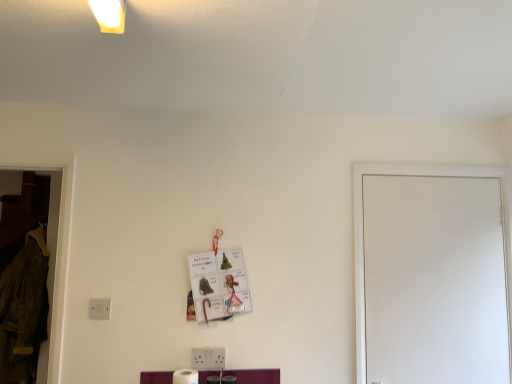
Question: In terms of width, does white matte toilet paper at lower center look wider or thinner when compared to velvet brown coat at left?

Choices:
 (A) wide
 (B) thin

Answer: (B)

Question: From the image's perspective, relative to velvet brown coat at left, is white matte toilet paper at lower center above or below?

Choices:
 (A) below
 (B) above

Answer: (A)

Question: Which object is positioned closest to the white matte toilet paper at lower center?

Choices:
 (A) velvet brown coat at left
 (B) white plastic electric outlet at lower left
 (C) white matte door at right

Answer: (B)

Question: Which of these objects is positioned farthest from the white plastic electric outlet at lower left?

Choices:
 (A) white matte toilet paper at lower center
 (B) white matte door at right
 (C) velvet brown coat at left

Answer: (B)